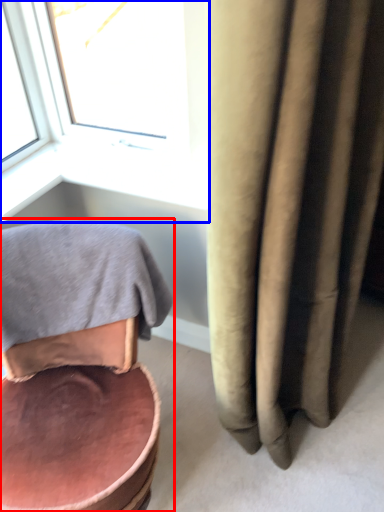
Question: Which object appears farthest to the camera in this image, chair (highlighted by a red box) or window (highlighted by a blue box)?

Choices:
 (A) chair
 (B) window

Answer: (B)